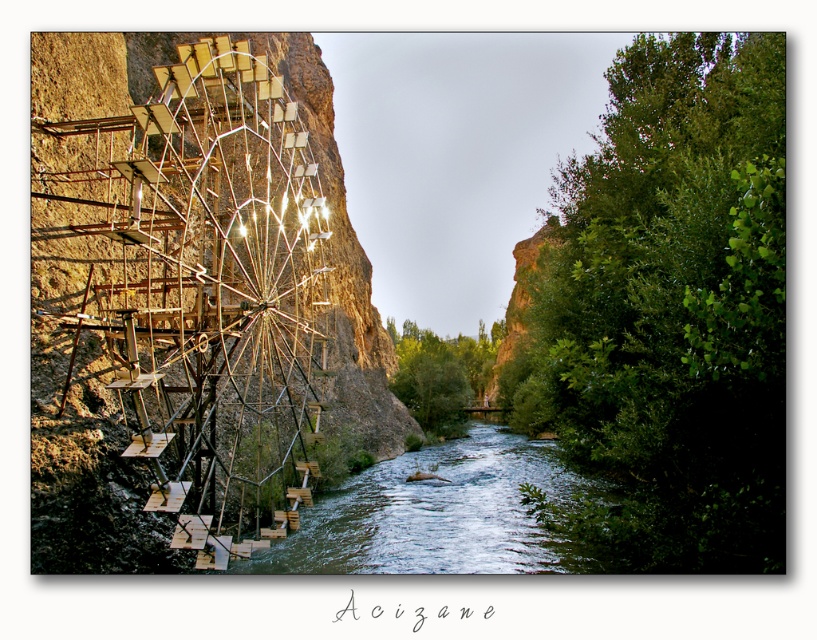
Question: Among these points, which one is nearest to the camera?

Choices:
 (A) (472, 442)
 (B) (317, 260)

Answer: (B)

Question: Is metallic ferris wheel at left bigger than greenish water at center?

Choices:
 (A) yes
 (B) no

Answer: (A)

Question: Can you confirm if metallic ferris wheel at left is positioned to the right of greenish water at center?

Choices:
 (A) yes
 (B) no

Answer: (B)

Question: From the image, what is the correct spatial relationship of metallic ferris wheel at left in relation to greenish water at center?

Choices:
 (A) above
 (B) below

Answer: (A)